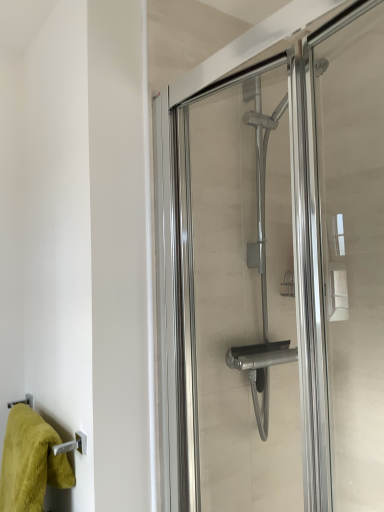
The image size is (384, 512). What do you see at coordinates (30, 462) in the screenshot?
I see `green fluffy towel at lower left` at bounding box center [30, 462].

Measure the distance between point (20, 440) and camera.

The distance of point (20, 440) from camera is 3.65 feet.

You are a GUI agent. You are given a task and a screenshot of the screen. Output one action in this format:
    pyautogui.click(x=<x>, y=<y>)
    Task: Click on the green fluffy towel at lower left
    
    Given the screenshot: What is the action you would take?
    pyautogui.click(x=30, y=462)

What do you see at coordinates (248, 295) in the screenshot? The image size is (384, 512). I see `clear glass shower door at center` at bounding box center [248, 295].

Where is `clear glass shower door at center`? The width and height of the screenshot is (384, 512). clear glass shower door at center is located at coordinates (248, 295).

The image size is (384, 512). What are the coordinates of `green fluffy towel at lower left` in the screenshot? It's located at (30, 462).

Would you say clear glass shower door at center is to the left or to the right of green fluffy towel at lower left in the picture?

Clearly, clear glass shower door at center is on the right of green fluffy towel at lower left in the image.

Considering the positions of objects clear glass shower door at center and green fluffy towel at lower left in the image provided, who is behind, clear glass shower door at center or green fluffy towel at lower left?

green fluffy towel at lower left is further from the camera.

Considering the points (246, 228) and (23, 436), which point is behind, point (246, 228) or point (23, 436)?

Positioned behind is point (246, 228).

From the image's perspective, is clear glass shower door at center located beneath green fluffy towel at lower left?

No, from the image's perspective, clear glass shower door at center is not below green fluffy towel at lower left.

From a real-world perspective, who is located higher, clear glass shower door at center or green fluffy towel at lower left?

In real-world perspective, clear glass shower door at center is above.

In terms of width, does clear glass shower door at center look wider or thinner when compared to green fluffy towel at lower left?

clear glass shower door at center is thinner than green fluffy towel at lower left.

From their relative heights in the image, would you say clear glass shower door at center is taller or shorter than green fluffy towel at lower left?

Considering their sizes, clear glass shower door at center has more height than green fluffy towel at lower left.

Considering the relative sizes of clear glass shower door at center and green fluffy towel at lower left in the image provided, is clear glass shower door at center bigger than green fluffy towel at lower left?

Yes, clear glass shower door at center is bigger than green fluffy towel at lower left.

Is green fluffy towel at lower left surrounded by clear glass shower door at center?

No, green fluffy towel at lower left is not inside clear glass shower door at center.

Is clear glass shower door at center beside green fluffy towel at lower left?

No, clear glass shower door at center is not with green fluffy towel at lower left.

In the scene shown: Is clear glass shower door at center turned away from green fluffy towel at lower left?

No.

How different are the orientations of clear glass shower door at center and green fluffy towel at lower left in degrees?

The facing directions of clear glass shower door at center and green fluffy towel at lower left are 9.99 degrees apart.

Measure the distance from clear glass shower door at center to green fluffy towel at lower left.

24.15 inches.

You are a GUI agent. You are given a task and a screenshot of the screen. Output one action in this format:
    pyautogui.click(x=<x>, y=<y>)
    Task: Click on the towel behind the clear glass shower door at center
    The width and height of the screenshot is (384, 512).
    Given the screenshot: What is the action you would take?
    pyautogui.click(x=30, y=462)

Considering the relative positions of green fluffy towel at lower left and clear glass shower door at center in the image provided, is green fluffy towel at lower left to the left of clear glass shower door at center from the viewer's perspective?

Correct, you'll find green fluffy towel at lower left to the left of clear glass shower door at center.

Considering the relative positions of green fluffy towel at lower left and clear glass shower door at center in the image provided, is green fluffy towel at lower left in front of clear glass shower door at center?

That is False.

Which point is more forward, (15, 460) or (268, 106)?

The point (15, 460) is in front.

From the image's perspective, between green fluffy towel at lower left and clear glass shower door at center, who is located below?

green fluffy towel at lower left is shown below in the image.

From a real-world perspective, is green fluffy towel at lower left on clear glass shower door at center?

No, from a real-world perspective, green fluffy towel at lower left is not on top of clear glass shower door at center.

Between green fluffy towel at lower left and clear glass shower door at center, which one has smaller width?

Thinner between the two is clear glass shower door at center.

Which of these two, green fluffy towel at lower left or clear glass shower door at center, stands shorter?

Standing shorter between the two is green fluffy towel at lower left.

Does green fluffy towel at lower left have a larger size compared to clear glass shower door at center?

Incorrect, green fluffy towel at lower left is not larger than clear glass shower door at center.

Would you say green fluffy towel at lower left is inside or outside clear glass shower door at center?

green fluffy towel at lower left lies outside clear glass shower door at center.

Would you consider green fluffy towel at lower left to be distant from clear glass shower door at center?

No, green fluffy towel at lower left is not far from clear glass shower door at center.

Is green fluffy towel at lower left positioned with its back to clear glass shower door at center?

No, green fluffy towel at lower left is not facing the opposite direction of clear glass shower door at center.

How different are the orientations of green fluffy towel at lower left and clear glass shower door at center in degrees?

The angular difference between green fluffy towel at lower left and clear glass shower door at center is 9.99 degrees.

Locate an element on the screen. This screenshot has height=512, width=384. screen door on the right of green fluffy towel at lower left is located at coordinates (248, 295).

I want to click on towel on the left of the clear glass shower door at center, so pos(30,462).

Find the location of a particular element. This screenshot has width=384, height=512. screen door in front of the green fluffy towel at lower left is located at coordinates (248, 295).